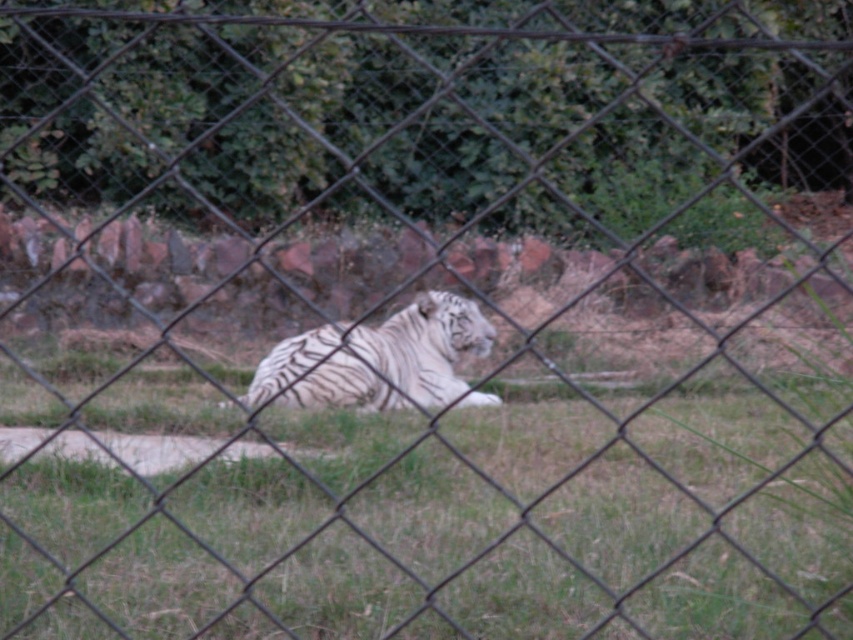
You are a zookeeper who needs to ensure the white striped tiger at center has enough space to move freely. Given that the green grass at center is under the tiger, does this indicate that the tiger is lying on the grass?

Yes, since the green grass at center is positioned under the white striped tiger at center, this means the tiger is lying on top of the grass, providing it with the necessary space to rest comfortably.

You are a zookeeper observing the enclosure through the fence. You notice the green grass at center and the white striped tiger at center. Which object takes up more space in the image?

The white striped tiger at center takes up more space in the image than the green grass at center.